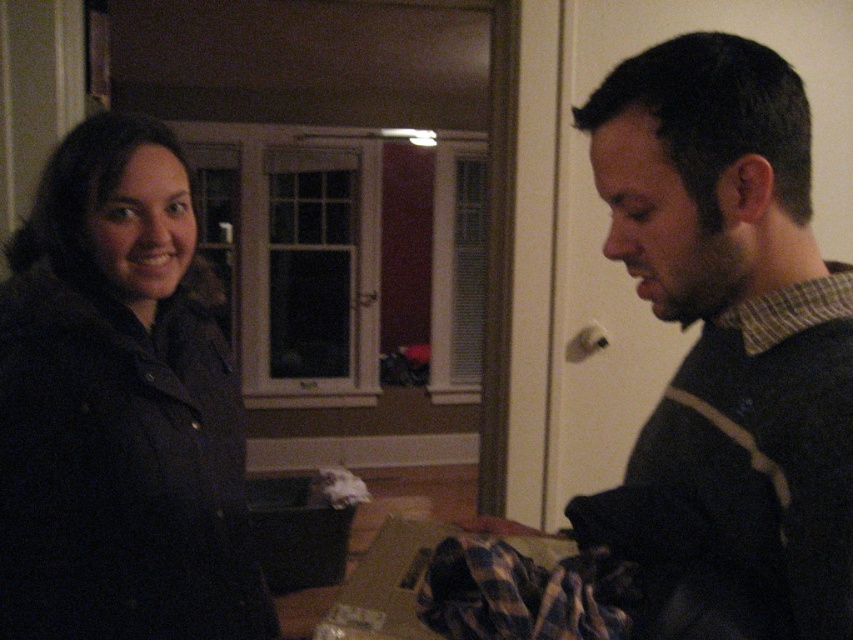
Question: Is dark brown sweater at right wider than dark matte jacket at left?

Choices:
 (A) no
 (B) yes

Answer: (A)

Question: Is dark brown sweater at right positioned before dark matte jacket at left?

Choices:
 (A) no
 (B) yes

Answer: (B)

Question: Which of the following is the closest to the observer?

Choices:
 (A) dark brown sweater at right
 (B) dark matte jacket at left

Answer: (A)

Question: Does dark brown sweater at right have a lesser width compared to dark matte jacket at left?

Choices:
 (A) yes
 (B) no

Answer: (A)